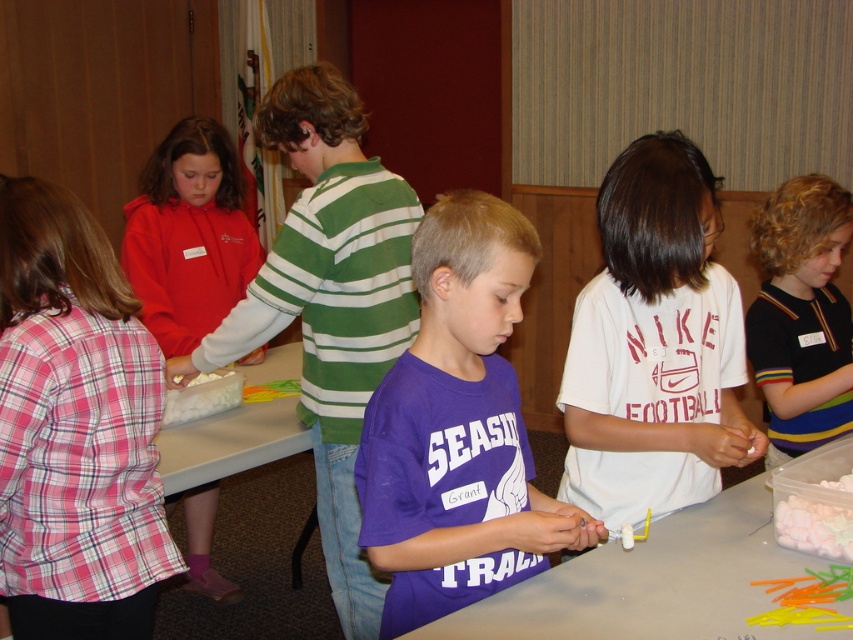
You are organizing a craft activity and need to ensure that the matte red hoodie at left can fit into a storage box designed for the white fluffy marshmallows at lower right. Based on their sizes, will the hoodie fit?

The matte red hoodie at left is wider than the white fluffy marshmallows at lower right, so it will not fit into the storage box designed for the marshmallows.

You are a teacher in the classroom and want to place a large poster on the wall behind the white plastic table at center and the matte red hoodie at left. Which object should you consider the size of when choosing the poster to ensure it fits appropriately?

The white plastic table at center occupies less space than the matte red hoodie at left, so you should consider the size of the matte red hoodie at left to ensure the poster is large enough to accommodate both objects.

You are a photographer trying to capture a candid shot of the children in the scene. You notice the white matte shirt at center and the black striped shirt at right. Which child should you focus on if you want to ensure the subject takes up more space in your photo?

The white matte shirt at center should be focused on because its width surpasses that of the black striped shirt at right, meaning it will appear larger in the photo.